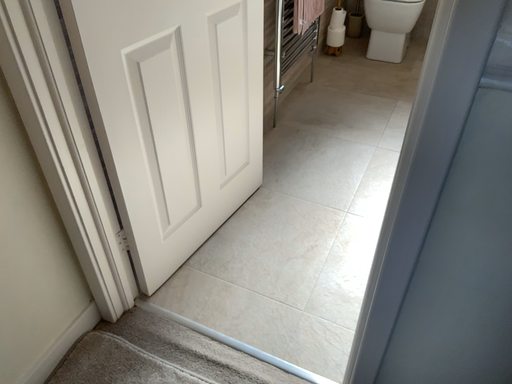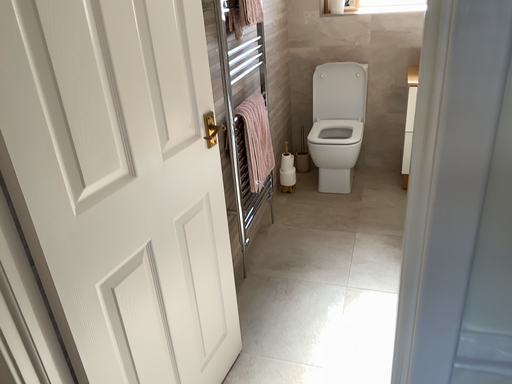
Question: Which way did the camera rotate in the video?

Choices:
 (A) rotated upward
 (B) rotated downward

Answer: (A)